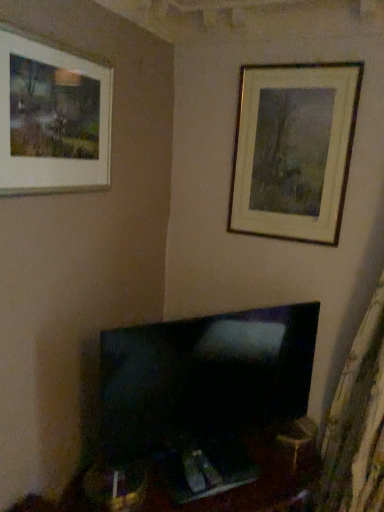
Question: Is gold metallic picture frame at upper right, which is the second picture frame in front-to-back order, situated inside matte white picture frame at upper left, which is the second picture frame in right-to-left order, or outside?

Choices:
 (A) inside
 (B) outside

Answer: (B)

Question: From a real-world perspective, relative to matte white picture frame at upper left, placed as the second picture frame when sorted from back to front, is gold metallic picture frame at upper right, which is the second picture frame in front-to-back order, vertically above or below?

Choices:
 (A) above
 (B) below

Answer: (B)

Question: Which of these objects is positioned closest to the black glossy tv at center?

Choices:
 (A) matte white picture frame at upper left, positioned as the 1th picture frame in front-to-back order
 (B) gold metallic picture frame at upper right, marked as the first picture frame in a back-to-front arrangement

Answer: (B)

Question: Considering the real-world distances, which object is closest to the matte white picture frame at upper left, positioned as the 1th picture frame in front-to-back order?

Choices:
 (A) gold metallic picture frame at upper right, marked as the first picture frame in a back-to-front arrangement
 (B) black glossy tv at center

Answer: (A)